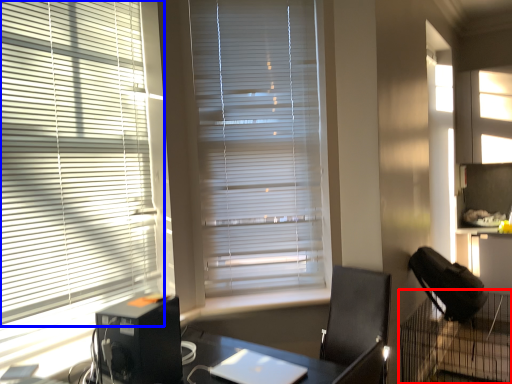
Question: Which object is further to the camera taking this photo, computer desk (highlighted by a red box) or window blind (highlighted by a blue box)?

Choices:
 (A) computer desk
 (B) window blind

Answer: (A)